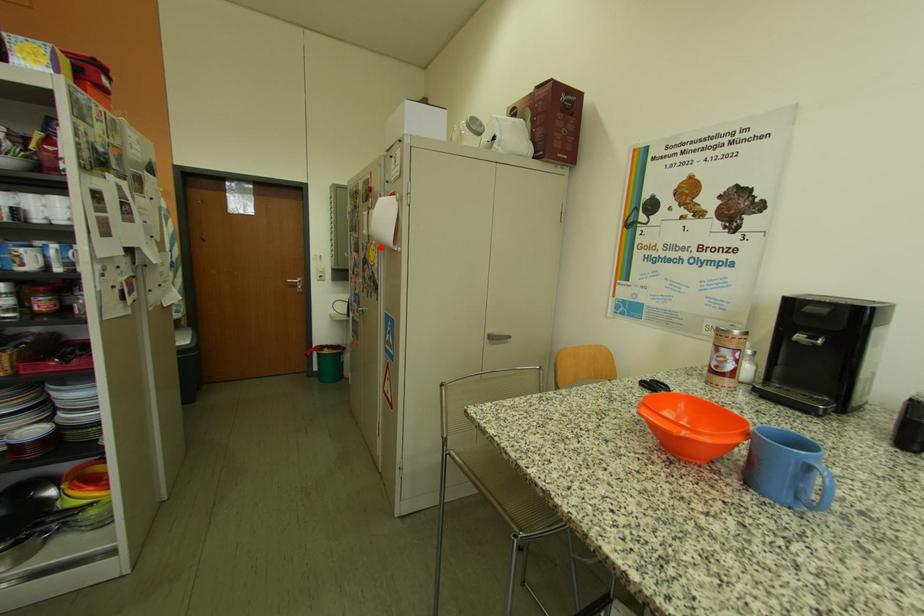
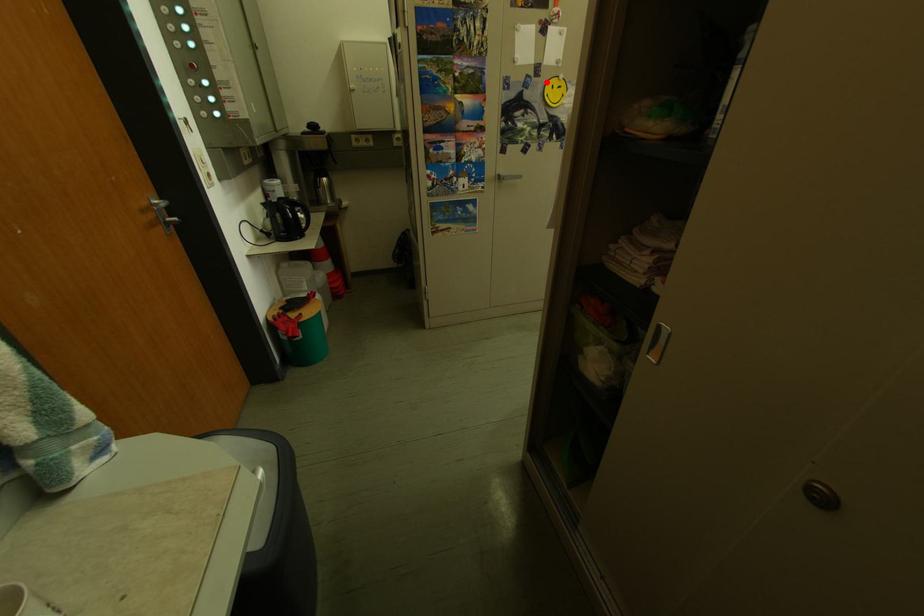
I am providing you with two images of the same scene from different viewpoints. A red point is marked on the first image and another point is marked on the second image. Is the marked point in image1 the same physical position as the marked point in image2?

Yes